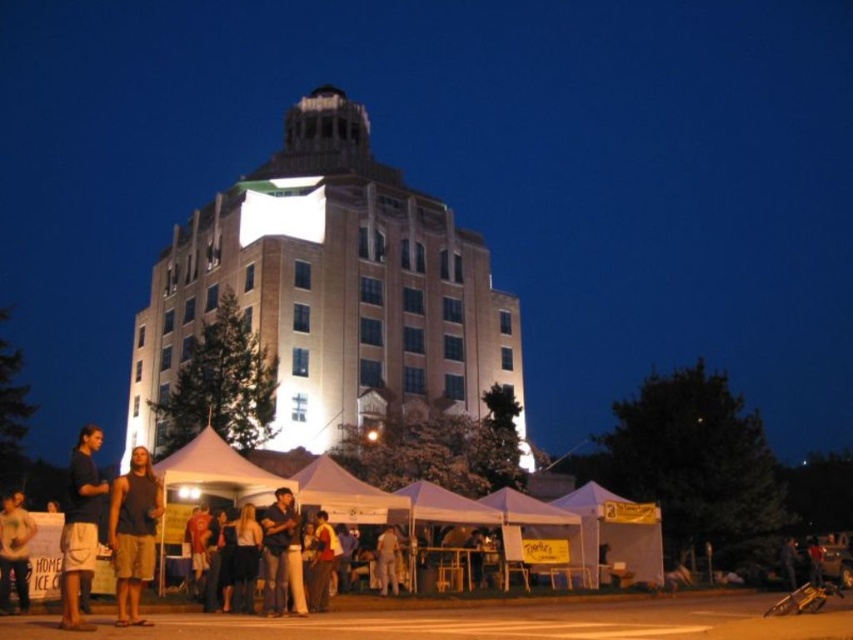
You are standing at the entrance of the white brick building at center and want to see the light brown leather jacket at lower left. Which object is closer to your current position?

The light brown leather jacket at lower left is closer to your current position because it is at the lower left, while the white brick building at center is much taller and further away.

You are at an event in front of the illuminated building. You see two people wearing a yellow cotton shirt at center and a light brown leather jacket at center. Which person is standing to the left of the other?

The yellow cotton shirt at center is positioned on the left side of light brown leather jacket at center, so the person wearing the yellow cotton shirt at center is standing to the left of the person wearing the light brown leather jacket at center.

You are attending an event at the illuminated building with a central dome. You notice two people wearing a dark blue shirt at center and a yellow cotton shirt at center. From your perspective facing the building, which shirt is positioned more to the left?

The dark blue shirt at center is positioned more to the left than the yellow cotton shirt at center.